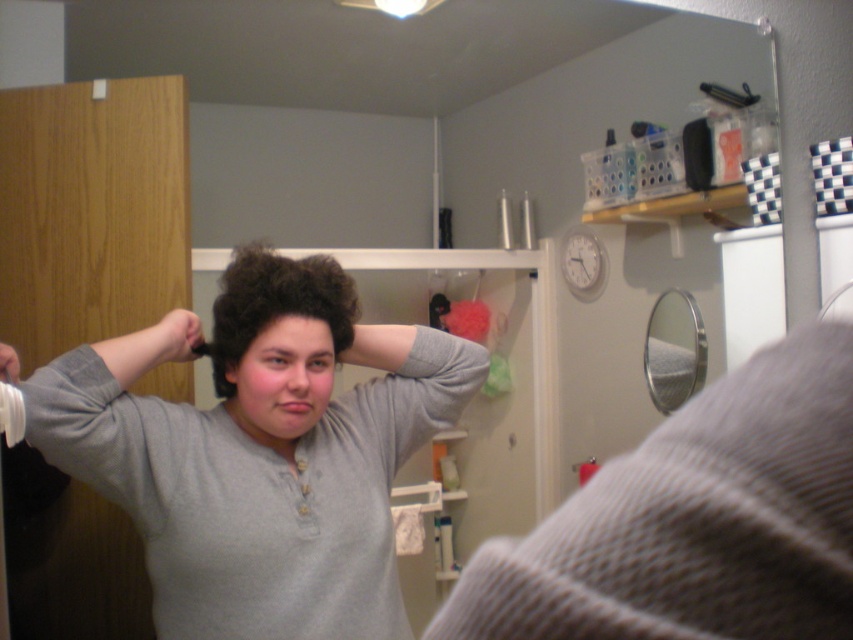
Which is more to the right, curly brown hair at center or matte gray hand at upper left?

Positioned to the right is curly brown hair at center.

Between curly brown hair at center and matte gray hand at upper left, which one is positioned higher?

curly brown hair at center is above.

This screenshot has height=640, width=853. Describe the element at coordinates (276, 305) in the screenshot. I see `curly brown hair at center` at that location.

Identify the location of curly brown hair at center. This screenshot has width=853, height=640. (276, 305).

Describe the element at coordinates (262, 454) in the screenshot. I see `gray matte shirt at center` at that location.

Is gray matte shirt at center taller than matte gray hand at upper left?

Yes, gray matte shirt at center is taller than matte gray hand at upper left.

At what (x,y) coordinates should I click in order to perform the action: click on gray matte shirt at center. Please return your answer as a coordinate pair (x, y). The height and width of the screenshot is (640, 853). Looking at the image, I should click on (262, 454).

This screenshot has width=853, height=640. What are the coordinates of `gray matte shirt at center` in the screenshot? It's located at (262, 454).

Is gray matte shirt at center closer to camera compared to smooth gray hairbrush at upper left?

Yes, it is in front of smooth gray hairbrush at upper left.

Between gray matte shirt at center and smooth gray hairbrush at upper left, which one is positioned higher?

smooth gray hairbrush at upper left is higher up.

Which is behind, point (134, 410) or point (3, 353)?

Point (134, 410)

Locate an element on the screen. The height and width of the screenshot is (640, 853). gray matte shirt at center is located at coordinates (262, 454).